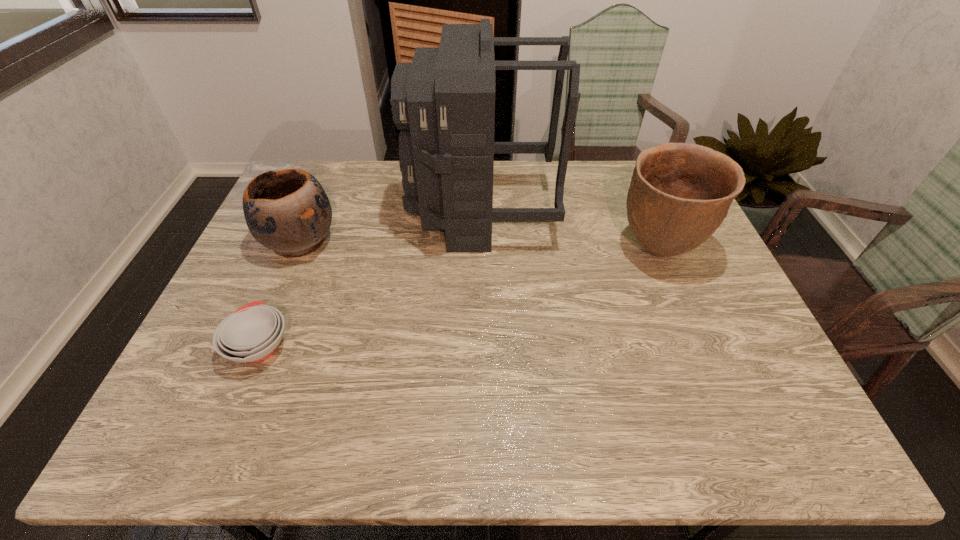
In the image, there is a desktop. What are the coordinates of `free region at the left edge` in the screenshot? It's located at (224, 361).

In the image, there is a desktop. Identify the location of free space at the right edge. Image resolution: width=960 pixels, height=540 pixels. coord(731,345).

Image resolution: width=960 pixels, height=540 pixels. What are the coordinates of `free space at the far left corner` in the screenshot? It's located at click(x=325, y=186).

The height and width of the screenshot is (540, 960). I want to click on free space at the near right corner of the desktop, so click(x=775, y=420).

I want to click on free space between the third object from left to right and the rightmost object, so click(x=570, y=231).

I want to click on blank region between the backpack and the right pottery, so click(x=570, y=231).

Identify the location of free space between the soup bowl and the shorter pottery. (280, 293).

The height and width of the screenshot is (540, 960). What are the coordinates of `free point between the tallest object and the nearest object` in the screenshot? It's located at (371, 279).

Where is `free space between the nearest object and the third shortest object`? free space between the nearest object and the third shortest object is located at coordinates (459, 298).

The height and width of the screenshot is (540, 960). Identify the location of vacant area between the right pottery and the nearest object. (459, 298).